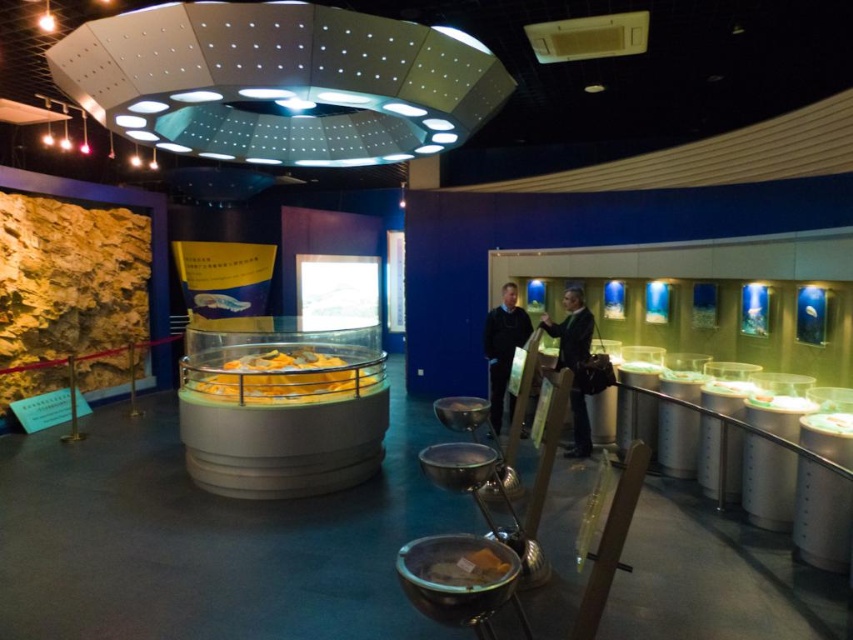
You are an artist planning to hang a large painting between the black leather jacket at center and the dark blue sweater at center. Since both items are at the center, how can you determine where to position the painting?

The black leather jacket at center occupies less space than the dark blue sweater at center, so you should position the painting in the area where the dark blue sweater at center is located since it takes up more space.

You are a museum visitor who wants to place both the black leather jacket at center and the dark blue sweater at center into a display case that can only accommodate items up to the width of the wider of the two. Which item determines the maximum width the case must be?

The black leather jacket at center determines the maximum width the case must be since its width is larger than the dark blue sweater at center.

You are standing in the exhibition space and want to move from the point at coordinates point (573, 337) to the point at coordinates point (515, 314). Which direction should you move to get closer to your destination?

To move from point (573, 337) to point (515, 314), you should move backward since point (573, 337) is in front of point (515, 314).